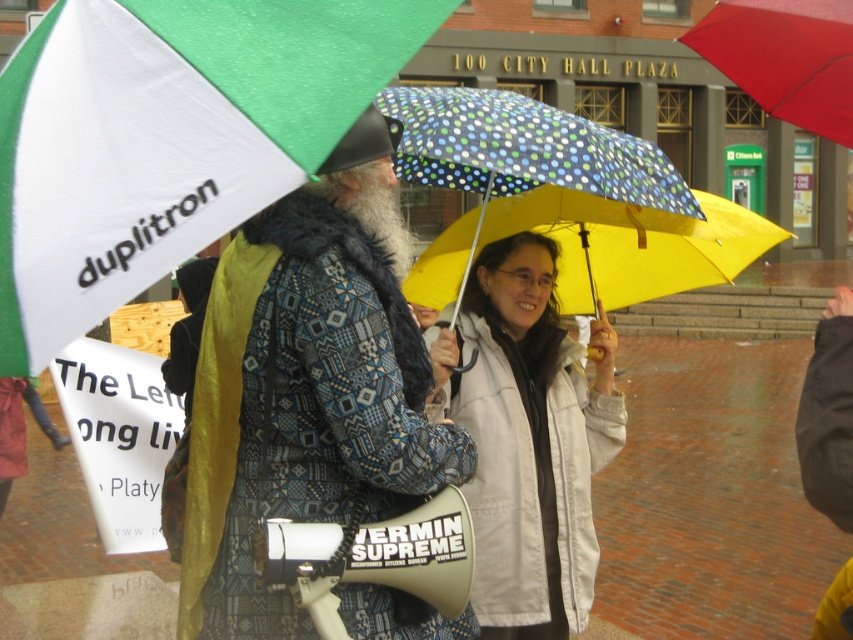
You are a photographer trying to capture a clear shot of the white matte jacket at center and the red matte umbrella at upper right. Based on their positions, which object is closer to the left side of the frame?

The white matte jacket at center is to the left of the red matte umbrella at upper right, so the white matte jacket at center is closer to the left side of the frame.

You are a photographer trying to capture a clear shot of the white matte jacket at center and the red matte umbrella at upper right. Based on their sizes in the image, which one would appear taller in the photo?

The white matte jacket at center appears taller in the photo since it has a greater height compared to the red matte umbrella at upper right.